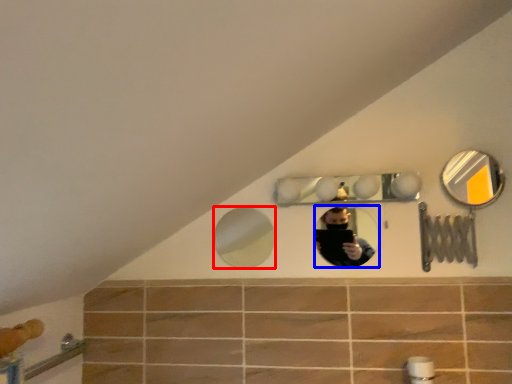
Question: Among these objects, which one is nearest to the camera, mirror (highlighted by a red box) or mirror (highlighted by a blue box)?

Choices:
 (A) mirror
 (B) mirror

Answer: (B)